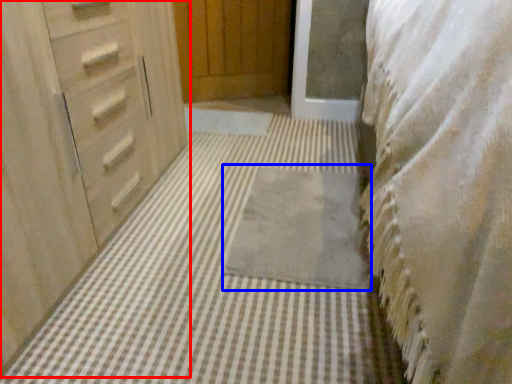
Question: Which of the following is the farthest to the observer, chest of drawers (highlighted by a red box) or bath mat (highlighted by a blue box)?

Choices:
 (A) chest of drawers
 (B) bath mat

Answer: (B)